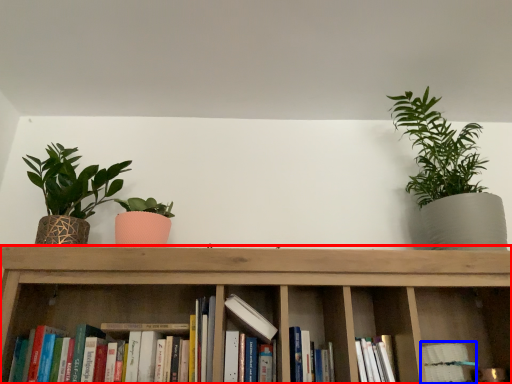
Question: Which of the following is the closest to the observer, shelf (highlighted by a red box) or book (highlighted by a blue box)?

Choices:
 (A) shelf
 (B) book

Answer: (A)